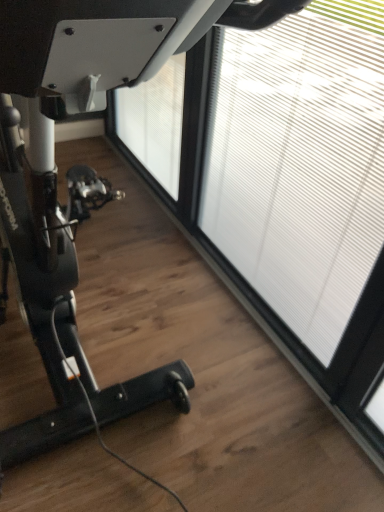
Question: Should I look upward or downward to see white matte window at right?

Choices:
 (A) up
 (B) down

Answer: (A)